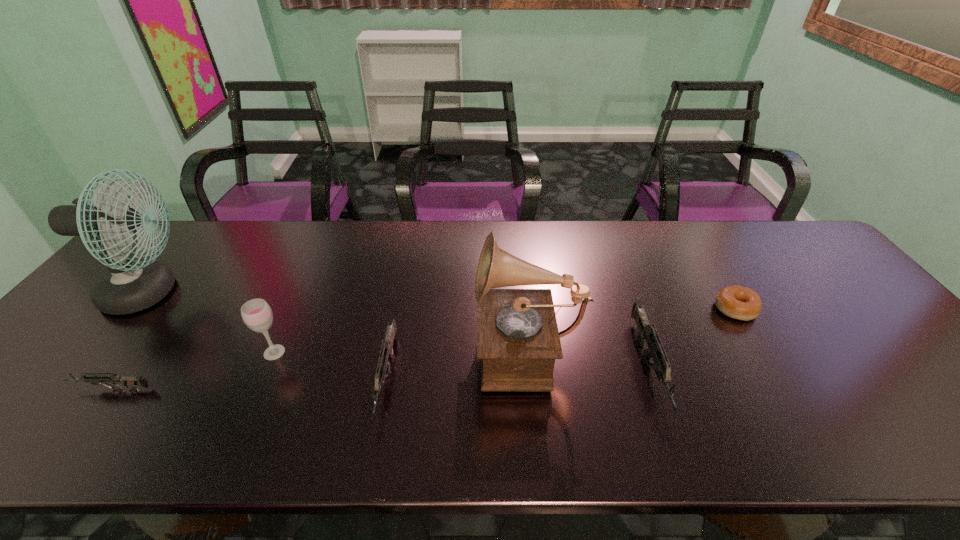
Identify the location of free spot that satisfies the following two spatial constraints: 1. aimed along the barrel of the third shortest object; 2. aimed along the barrel of the leftmost gun. Image resolution: width=960 pixels, height=540 pixels. (384, 389).

This screenshot has width=960, height=540. What are the coordinates of `free point that satisfies the following two spatial constraints: 1. on the back side of the bagel; 2. in front of the fan where the airflow is directed` in the screenshot? It's located at (726, 293).

Locate an element on the screen. This screenshot has height=540, width=960. free space that satisfies the following two spatial constraints: 1. in front of the fan where the airflow is directed; 2. on the back side of the fifth shortest object is located at coordinates click(x=100, y=352).

The width and height of the screenshot is (960, 540). Identify the location of vacant region that satisfies the following two spatial constraints: 1. in front of the fan where the airflow is directed; 2. on the right side of the third tallest object. (100, 352).

Find the location of a particular element. This screenshot has width=960, height=540. free space that satisfies the following two spatial constraints: 1. on the front side of the rightmost object; 2. on the horn of the fifth object from left to right is located at coordinates (758, 347).